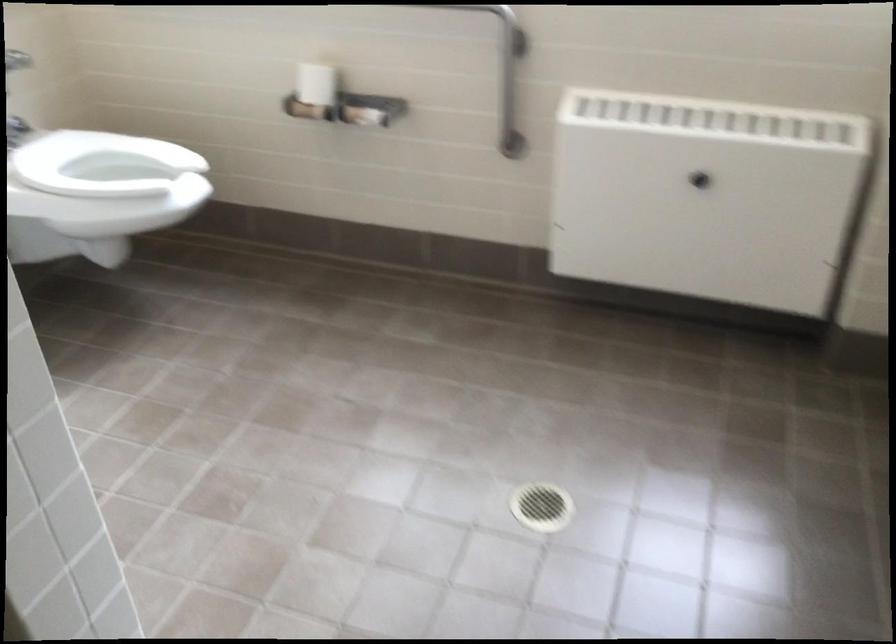
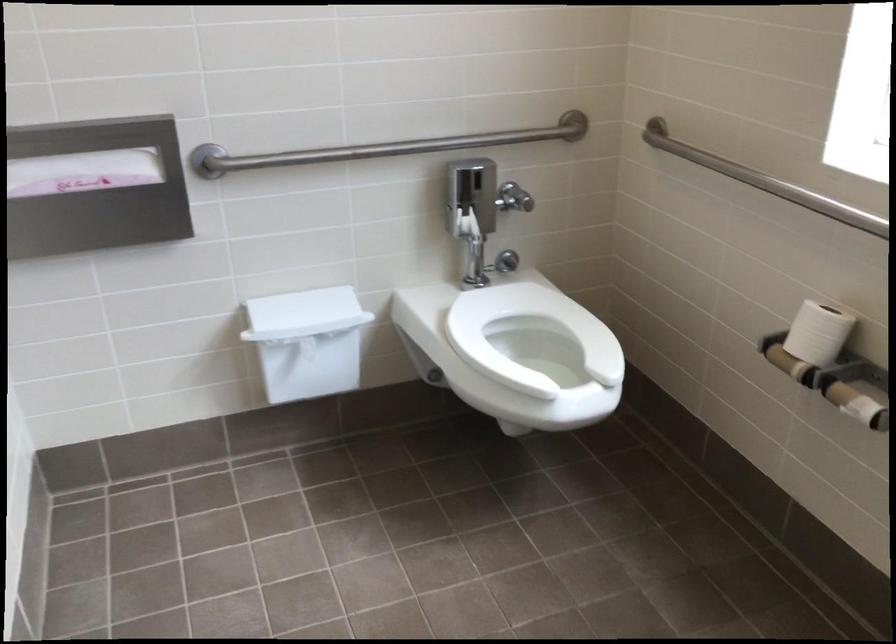
Locate, in the second image, the point that corresponds to [316,86] in the first image.

(817, 333)